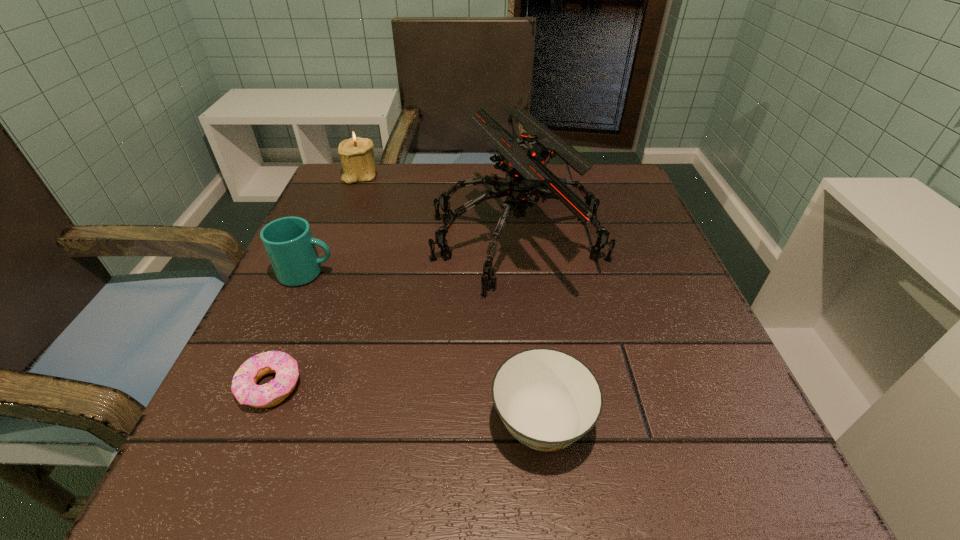
You are a GUI agent. You are given a task and a screenshot of the screen. Output one action in this format:
    pyautogui.click(x=<x>, y=<y>)
    Task: Click on the blank space at the far edge of the desktop
    The width and height of the screenshot is (960, 540).
    Given the screenshot: What is the action you would take?
    pyautogui.click(x=416, y=179)

Locate an element on the screen. free space at the near edge is located at coordinates pyautogui.click(x=419, y=476).

Locate an element on the screen. This screenshot has width=960, height=540. vacant space at the left edge is located at coordinates (353, 305).

Locate an element on the screen. This screenshot has height=540, width=960. free space at the right edge of the desktop is located at coordinates (702, 348).

Where is `free location at the far left corner`? The image size is (960, 540). free location at the far left corner is located at coordinates (389, 184).

Image resolution: width=960 pixels, height=540 pixels. Identify the location of free space at the near right corner of the desktop. (760, 464).

Locate an element on the screen. This screenshot has height=540, width=960. empty location between the third tallest object and the fourth tallest object is located at coordinates (424, 348).

Locate an element on the screen. The width and height of the screenshot is (960, 540). free space between the soup bowl and the doughnut is located at coordinates (406, 405).

Image resolution: width=960 pixels, height=540 pixels. Find the location of `free spot between the tallest object and the third tallest object`. free spot between the tallest object and the third tallest object is located at coordinates (413, 256).

Identify the location of free space between the soup bowl and the shortest object. (406, 405).